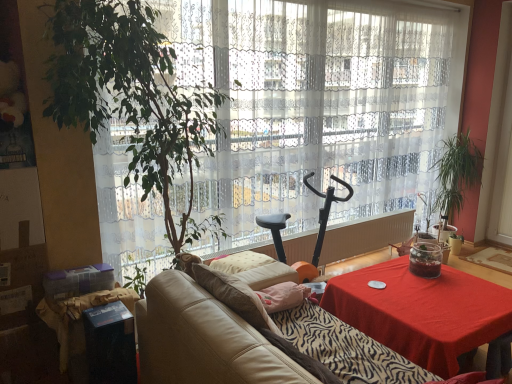
Where is `translucent glass jar at center`? translucent glass jar at center is located at coordinates coord(425,260).

Where is `green leafy plant at right`? This screenshot has height=384, width=512. green leafy plant at right is located at coordinates (456, 173).

Where is `translucent glass jar at center`? The height and width of the screenshot is (384, 512). translucent glass jar at center is located at coordinates pyautogui.click(x=425, y=260).

Looking at this image, in the image, is green leafy plant at right positioned in front of or behind black plastic exercise bike at center?

In the image, green leafy plant at right appears behind black plastic exercise bike at center.

Would you say green leafy plant at right is outside black plastic exercise bike at center?

Yes, green leafy plant at right is outside of black plastic exercise bike at center.

Between green leafy plant at right and black plastic exercise bike at center, which one has more height?

With more height is green leafy plant at right.

Does green leafy plant at right have a smaller size compared to black plastic exercise bike at center?

Indeed, green leafy plant at right has a smaller size compared to black plastic exercise bike at center.

How many degrees apart are the facing directions of red cloth-covered table at lower right and translucent glass jar at center?

There is a 2.86e-05-degree angle between the facing directions of red cloth-covered table at lower right and translucent glass jar at center.

From the image's perspective, is red cloth-covered table at lower right positioned above or below translucent glass jar at center?

From the image's perspective, red cloth-covered table at lower right appears below translucent glass jar at center.

Does red cloth-covered table at lower right have a lesser height compared to translucent glass jar at center?

Incorrect, the height of red cloth-covered table at lower right does not fall short of that of translucent glass jar at center.

Considering the sizes of objects red cloth-covered table at lower right and translucent glass jar at center in the image provided, who is wider, red cloth-covered table at lower right or translucent glass jar at center?

Wider between the two is red cloth-covered table at lower right.

Based on the photo, what's the angular difference between green leafy plant at right and transparent lace curtain at center's facing directions?

3.06 degrees separate the facing orientations of green leafy plant at right and transparent lace curtain at center.

From the image's perspective, between green leafy plant at right and transparent lace curtain at center, which one is located above?

transparent lace curtain at center, from the image's perspective.

Which object is closer to the camera taking this photo, green leafy plant at right or transparent lace curtain at center?

transparent lace curtain at center is in front.

Between point (455, 179) and point (105, 150), which one is positioned behind?

Positioned behind is point (455, 179).

Where is `cocktail table beneath the leather couch at center (from a real-world perspective)`? cocktail table beneath the leather couch at center (from a real-world perspective) is located at coordinates (110, 344).

Considering the points (131, 357) and (209, 377), which point is in front, point (131, 357) or point (209, 377)?

The point (209, 377) is closer to the camera.

Considering the relative sizes of black cardboard box at lower left and leather couch at center in the image provided, is black cardboard box at lower left thinner than leather couch at center?

Yes, black cardboard box at lower left is thinner than leather couch at center.

Looking at this image, looking at their sizes, would you say black cardboard box at lower left is wider or thinner than green leafy plant at right?

In the image, black cardboard box at lower left appears to be more narrow than green leafy plant at right.

Considering the relative sizes of black cardboard box at lower left and green leafy plant at right in the image provided, is black cardboard box at lower left taller than green leafy plant at right?

No, black cardboard box at lower left is not taller than green leafy plant at right.

Looking at this image, are black cardboard box at lower left and green leafy plant at right far apart?

Yes, black cardboard box at lower left is far from green leafy plant at right.

Do you think black cardboard box at lower left is within green leafy plant at right, or outside of it?

black cardboard box at lower left exists outside the volume of green leafy plant at right.

From a real-world perspective, does black plastic exercise bike at center stand above translucent glass jar at center?

No.

In terms of size, does black plastic exercise bike at center appear bigger or smaller than translucent glass jar at center?

Clearly, black plastic exercise bike at center is larger in size than translucent glass jar at center.

From the image's perspective, who appears lower, black plastic exercise bike at center or translucent glass jar at center?

translucent glass jar at center is shown below in the image.

Is black plastic exercise bike at center thinner than translucent glass jar at center?

In fact, black plastic exercise bike at center might be wider than translucent glass jar at center.

Looking at this image, between translucent glass jar at center and red cloth-covered table at lower right, which one has smaller width?

Thinner between the two is translucent glass jar at center.

Considering the sizes of objects translucent glass jar at center and red cloth-covered table at lower right in the image provided, who is bigger, translucent glass jar at center or red cloth-covered table at lower right?

Bigger between the two is red cloth-covered table at lower right.

Is translucent glass jar at center located outside red cloth-covered table at lower right?

Yes.

Locate an element on the screen. This screenshot has height=384, width=512. swivel chair located in front of the green leafy plant at right is located at coordinates (320, 226).

Where is `food that is above the red cloth-covered table at lower right (from a real-world perspective)`? The height and width of the screenshot is (384, 512). food that is above the red cloth-covered table at lower right (from a real-world perspective) is located at coordinates (425, 260).

From the picture: Considering their positions, is black plastic exercise bike at center positioned closer to transparent lace curtain at center than black cardboard box at lower left?

black plastic exercise bike at center is closer to transparent lace curtain at center.

Looking at the image, which one is located closer to black plastic exercise bike at center, transparent lace curtain at center or leather couch at center?

Based on the image, transparent lace curtain at center appears to be nearer to black plastic exercise bike at center.

When comparing their distances from leather couch at center, does translucent glass jar at center or red cloth-covered table at lower right seem closer?

Among the two, red cloth-covered table at lower right is located nearer to leather couch at center.

Which object lies further to the anchor point red cloth-covered table at lower right, green leafy plant at right or black plastic exercise bike at center?

green leafy plant at right is further to red cloth-covered table at lower right.

Which object lies nearer to the anchor point green leafy plant at right, black plastic exercise bike at center or red cloth-covered table at lower right?

black plastic exercise bike at center is closer to green leafy plant at right.

Looking at the image, which one is located closer to green leafy plant at right, leather couch at center or black cardboard box at lower left?

The object closer to green leafy plant at right is leather couch at center.

Looking at the image, which one is located further to black plastic exercise bike at center, green leafy plant at left or red cloth-covered table at lower right?

The object further to black plastic exercise bike at center is green leafy plant at left.

Considering their positions, is red cloth-covered table at lower right positioned further to black plastic exercise bike at center than translucent glass jar at center?

red cloth-covered table at lower right lies further to black plastic exercise bike at center than the other object.

Where is `vegetation between transparent lace curtain at center and black cardboard box at lower left vertically`? vegetation between transparent lace curtain at center and black cardboard box at lower left vertically is located at coordinates (132, 97).

Find the location of a particular element. The width and height of the screenshot is (512, 384). table between black cardboard box at lower left and translucent glass jar at center is located at coordinates (422, 311).

In order to click on vegetation between black cardboard box at lower left and translucent glass jar at center from left to right in this screenshot , I will do `click(132, 97)`.

The image size is (512, 384). Identify the location of food between black plastic exercise bike at center and green leafy plant at right in the horizontal direction. (425, 260).